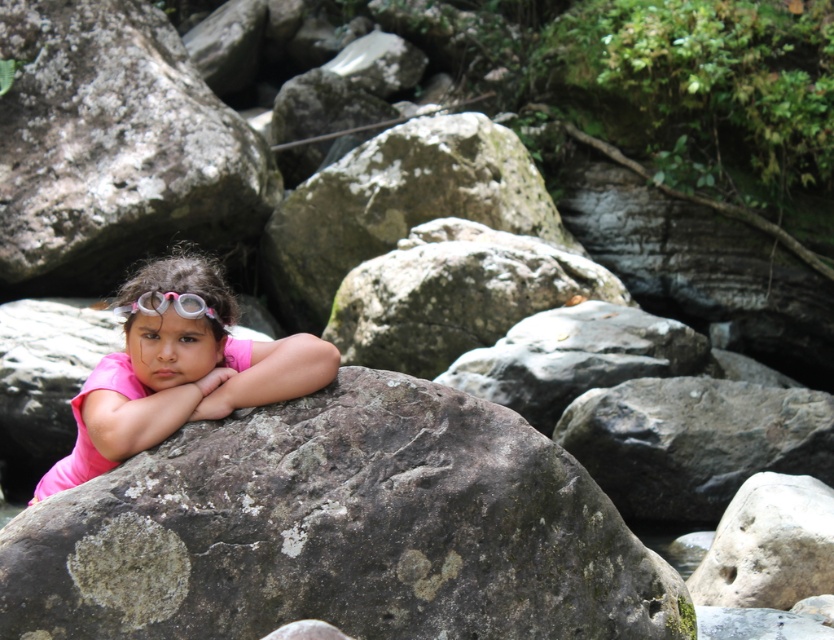
You are standing in a rocky area and see two points marked in the image. The first point is at coordinates point (18, 627) and the second is at point (149, 305). Which point is closer to you?

Point (18, 627) is closer to the viewer than point (149, 305).

You are a hiker who has just reached the center of the rocky area. You notice the speckled rock at center and the pink matte shirt at center. Which object is positioned more to the east if the sunlight is coming from the west?

The speckled rock at center is to the right of the pink matte shirt at center. Since sunlight comes from the west, the right side would be east. Therefore, the speckled rock at center is positioned more to the east.

You are a photographer trying to capture the speckled rock at center and the pink rubber goggles at center in the same frame. Which object should you focus on first to ensure both are in focus?

The speckled rock at center is in front of the pink rubber goggles at center, so you should focus on the speckled rock at center first to ensure both are in focus.